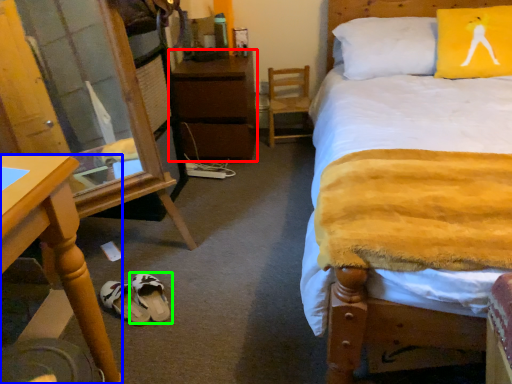
Question: Considering the real-world distances, which object is farthest from nightstand (highlighted by a red box)? desk (highlighted by a blue box) or footwear (highlighted by a green box)?

Choices:
 (A) desk
 (B) footwear

Answer: (A)